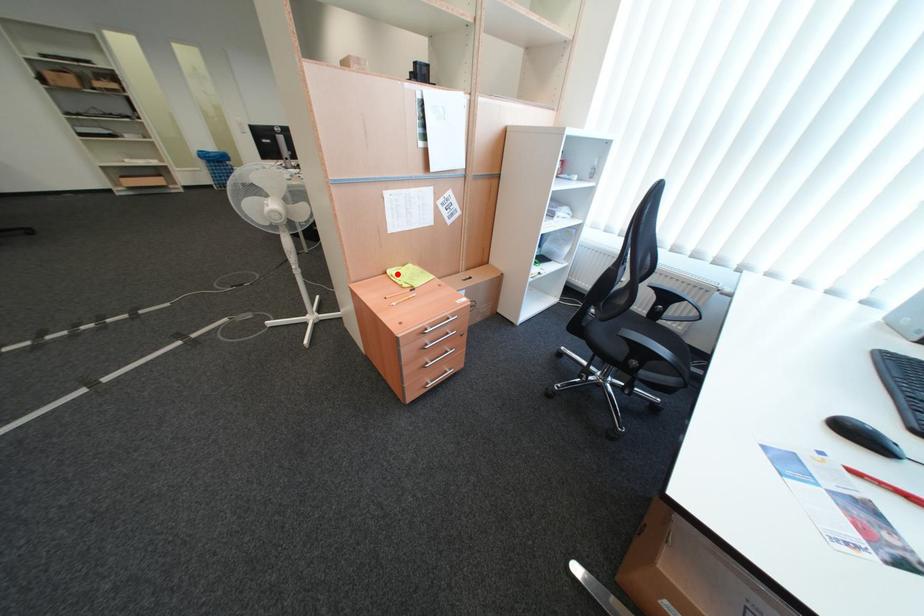
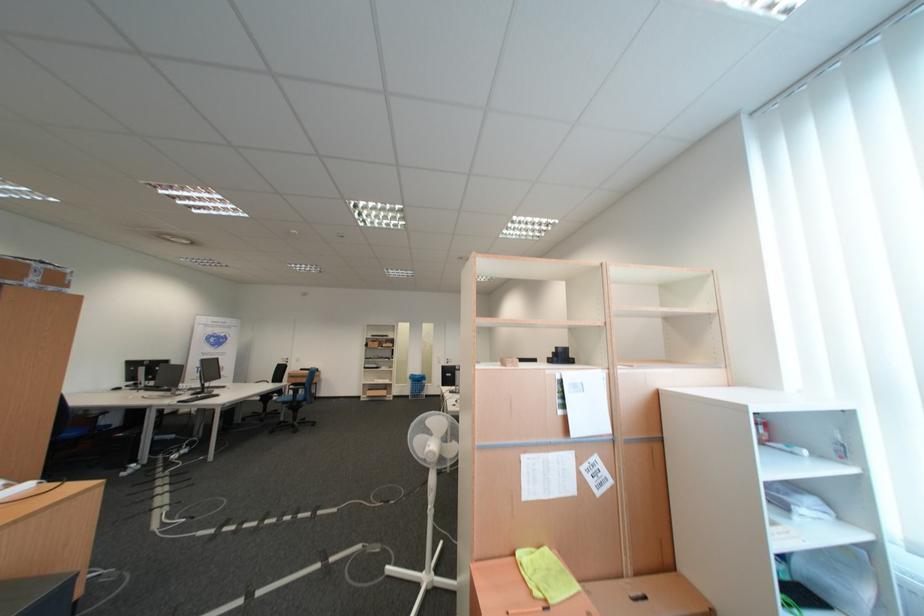
The point at the highlighted location is marked in the first image. Where is the corresponding point in the second image?

(526, 556)